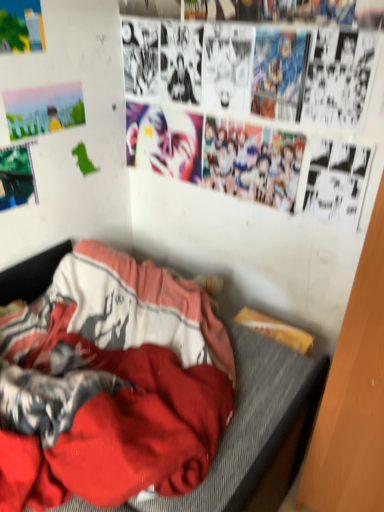
In order to click on watercolor paper poster at upper left, the 2th poster page viewed from the top in this screenshot , I will do click(x=43, y=109).

How much space does watercolor paper poster at upper left, the 2th poster page viewed from the top, occupy horizontally?

watercolor paper poster at upper left, the 2th poster page viewed from the top, is 0.45 inches wide.

Consider the image. How much space does metallic green poster at upper left, the 3th poster page when ordered from top to bottom, occupy horizontally?

metallic green poster at upper left, the 3th poster page when ordered from top to bottom, is 0.39 inches in width.

Locate an element on the screen. The height and width of the screenshot is (512, 384). watercolor paper poster at upper left, which is the second poster page in bottom-to-top order is located at coordinates (43, 109).

Considering their positions, is matte paper poster at upper left, acting as the 1th poster page starting from the top, located in front of or behind red fabric bed at lower left?

matte paper poster at upper left, acting as the 1th poster page starting from the top, is behind red fabric bed at lower left.

Is matte paper poster at upper left, acting as the 1th poster page starting from the top, aimed at red fabric bed at lower left?

No, matte paper poster at upper left, acting as the 1th poster page starting from the top, is not oriented towards red fabric bed at lower left.

From the picture: Considering the relative sizes of matte paper poster at upper left, acting as the 1th poster page starting from the top, and red fabric bed at lower left in the image provided, is matte paper poster at upper left, acting as the 1th poster page starting from the top, wider than red fabric bed at lower left?

No.

Where is `bed on the right side of matte paper poster at upper left, the third poster page ordered from the bottom`? bed on the right side of matte paper poster at upper left, the third poster page ordered from the bottom is located at coordinates (151, 407).

Image resolution: width=384 pixels, height=512 pixels. What are the coordinates of `person above the metallic green poster at upper left, the 3th poster page when ordered from top to bottom (from the image's perspective)` in the screenshot? It's located at (164, 141).

In terms of width, does metallic green poster at upper left, which ranks as the first poster page in bottom-to-top order, look wider or thinner when compared to shiny metallic mask at upper center?

Clearly, metallic green poster at upper left, which ranks as the first poster page in bottom-to-top order, has less width compared to shiny metallic mask at upper center.

How many degrees apart are the facing directions of metallic green poster at upper left, the 3th poster page when ordered from top to bottom, and shiny metallic mask at upper center?

The angular difference between metallic green poster at upper left, the 3th poster page when ordered from top to bottom, and shiny metallic mask at upper center is 89.2 degrees.

Which point is more forward, [22,186] or [161,155]?

The point [22,186] is in front.

Is the depth of shiny metallic mask at upper center less than that of metallic green poster at upper left, which ranks as the first poster page in bottom-to-top order?

No, shiny metallic mask at upper center is further to the viewer.

Between shiny metallic mask at upper center and metallic green poster at upper left, the 3th poster page when ordered from top to bottom, which one has larger width?

Wider between the two is shiny metallic mask at upper center.

From a real-world perspective, which is physically above, shiny metallic mask at upper center or metallic green poster at upper left, the 3th poster page when ordered from top to bottom?

shiny metallic mask at upper center is physically above.

Could you tell me if shiny metallic mask at upper center is facing metallic green poster at upper left, the 3th poster page when ordered from top to bottom?

Yes, shiny metallic mask at upper center faces towards metallic green poster at upper left, the 3th poster page when ordered from top to bottom.

Is watercolor paper poster at upper left, which is the second poster page in bottom-to-top order, in contact with matte paper poster at upper left, acting as the 1th poster page starting from the top?

No, watercolor paper poster at upper left, which is the second poster page in bottom-to-top order, is not beside matte paper poster at upper left, acting as the 1th poster page starting from the top.

Can you confirm if watercolor paper poster at upper left, the 2th poster page viewed from the top, is taller than matte paper poster at upper left, the third poster page ordered from the bottom?

Incorrect, the height of watercolor paper poster at upper left, the 2th poster page viewed from the top, is not larger of that of matte paper poster at upper left, the third poster page ordered from the bottom.

From a real-world perspective, which object stands above the other?

matte paper poster at upper left, acting as the 1th poster page starting from the top, from a real-world perspective.

Which of these two, watercolor paper poster at upper left, which is the second poster page in bottom-to-top order, or shiny metallic mask at upper center, stands taller?

shiny metallic mask at upper center is taller.

From the image's perspective, which one is positioned higher, watercolor paper poster at upper left, which is the second poster page in bottom-to-top order, or shiny metallic mask at upper center?

From the image's view, watercolor paper poster at upper left, which is the second poster page in bottom-to-top order, is above.

Is watercolor paper poster at upper left, the 2th poster page viewed from the top, facing towards shiny metallic mask at upper center?

No, watercolor paper poster at upper left, the 2th poster page viewed from the top, is not facing towards shiny metallic mask at upper center.

Is watercolor paper poster at upper left, which is the second poster page in bottom-to-top order, surrounding shiny metallic mask at upper center?

No, shiny metallic mask at upper center is not inside watercolor paper poster at upper left, which is the second poster page in bottom-to-top order.

From a real-world perspective, is metallic green poster at upper left, the 3th poster page when ordered from top to bottom, located beneath matte paper poster at upper left, the third poster page ordered from the bottom?

Yes, from a real-world perspective, metallic green poster at upper left, the 3th poster page when ordered from top to bottom, is under matte paper poster at upper left, the third poster page ordered from the bottom.

Considering their positions, is metallic green poster at upper left, the 3th poster page when ordered from top to bottom, located in front of or behind matte paper poster at upper left, acting as the 1th poster page starting from the top?

In the image, metallic green poster at upper left, the 3th poster page when ordered from top to bottom, appears behind matte paper poster at upper left, acting as the 1th poster page starting from the top.

Which object is thinner, metallic green poster at upper left, which ranks as the first poster page in bottom-to-top order, or matte paper poster at upper left, the third poster page ordered from the bottom?

metallic green poster at upper left, which ranks as the first poster page in bottom-to-top order.

Who is bigger, metallic green poster at upper left, which ranks as the first poster page in bottom-to-top order, or matte paper poster at upper left, acting as the 1th poster page starting from the top?

metallic green poster at upper left, which ranks as the first poster page in bottom-to-top order.

Considering the relative positions of shiny metallic mask at upper center and matte paper poster at upper left, the third poster page ordered from the bottom, in the image provided, is shiny metallic mask at upper center to the left of matte paper poster at upper left, the third poster page ordered from the bottom, from the viewer's perspective?

No.

Which object is closer to the camera taking this photo, shiny metallic mask at upper center or matte paper poster at upper left, acting as the 1th poster page starting from the top?

matte paper poster at upper left, acting as the 1th poster page starting from the top, is closer to the camera.

Can you tell me how much shiny metallic mask at upper center and matte paper poster at upper left, acting as the 1th poster page starting from the top, differ in facing direction?

89.9 degrees.

Can you confirm if shiny metallic mask at upper center is wider than matte paper poster at upper left, the third poster page ordered from the bottom?

Indeed, shiny metallic mask at upper center has a greater width compared to matte paper poster at upper left, the third poster page ordered from the bottom.

Image resolution: width=384 pixels, height=512 pixels. I want to click on the 2nd poster page to the left of the red fabric bed at lower left, starting your count from the anchor, so click(x=21, y=26).

Identify the location of person that is above the metallic green poster at upper left, the 3th poster page when ordered from top to bottom (from the image's perspective). (164, 141).

When comparing their distances from red fabric bed at lower left, does watercolor paper poster at upper left, the 2th poster page viewed from the top, or matte paper poster at upper left, acting as the 1th poster page starting from the top, seem further?

Based on the image, matte paper poster at upper left, acting as the 1th poster page starting from the top, appears to be further to red fabric bed at lower left.

When comparing their distances from matte paper poster at upper left, acting as the 1th poster page starting from the top, does shiny metallic mask at upper center or metallic green poster at upper left, the 3th poster page when ordered from top to bottom, seem further?

shiny metallic mask at upper center lies further to matte paper poster at upper left, acting as the 1th poster page starting from the top, than the other object.

Estimate the real-world distances between objects in this image. Which object is closer to matte paper poster at upper left, the third poster page ordered from the bottom, red fabric bed at lower left or shiny metallic mask at upper center?

The object closer to matte paper poster at upper left, the third poster page ordered from the bottom, is shiny metallic mask at upper center.

When comparing their distances from shiny metallic mask at upper center, does matte paper poster at upper left, acting as the 1th poster page starting from the top, or red fabric bed at lower left seem closer?

The object closer to shiny metallic mask at upper center is matte paper poster at upper left, acting as the 1th poster page starting from the top.

Based on their spatial positions, is metallic green poster at upper left, the 3th poster page when ordered from top to bottom, or matte paper poster at upper left, the third poster page ordered from the bottom, closer to shiny metallic mask at upper center?

Based on the image, metallic green poster at upper left, the 3th poster page when ordered from top to bottom, appears to be nearer to shiny metallic mask at upper center.

Considering their positions, is shiny metallic mask at upper center positioned further to matte paper poster at upper left, the third poster page ordered from the bottom, than red fabric bed at lower left?

red fabric bed at lower left lies further to matte paper poster at upper left, the third poster page ordered from the bottom, than the other object.

When comparing their distances from watercolor paper poster at upper left, the 2th poster page viewed from the top, does metallic green poster at upper left, the 3th poster page when ordered from top to bottom, or shiny metallic mask at upper center seem closer?

Among the two, metallic green poster at upper left, the 3th poster page when ordered from top to bottom, is located nearer to watercolor paper poster at upper left, the 2th poster page viewed from the top.

Estimate the real-world distances between objects in this image. Which object is closer to metallic green poster at upper left, the 3th poster page when ordered from top to bottom, matte paper poster at upper left, the third poster page ordered from the bottom, or watercolor paper poster at upper left, which is the second poster page in bottom-to-top order?

The object closer to metallic green poster at upper left, the 3th poster page when ordered from top to bottom, is watercolor paper poster at upper left, which is the second poster page in bottom-to-top order.

Where is `poster page between matte paper poster at upper left, acting as the 1th poster page starting from the top, and metallic green poster at upper left, which ranks as the first poster page in bottom-to-top order, from top to bottom`? poster page between matte paper poster at upper left, acting as the 1th poster page starting from the top, and metallic green poster at upper left, which ranks as the first poster page in bottom-to-top order, from top to bottom is located at coordinates (43, 109).

Where is `poster page between watercolor paper poster at upper left, which is the second poster page in bottom-to-top order, and red fabric bed at lower left from top to bottom`? This screenshot has width=384, height=512. poster page between watercolor paper poster at upper left, which is the second poster page in bottom-to-top order, and red fabric bed at lower left from top to bottom is located at coordinates (16, 177).

Where is `person between matte paper poster at upper left, the third poster page ordered from the bottom, and red fabric bed at lower left in the up-down direction`? This screenshot has width=384, height=512. person between matte paper poster at upper left, the third poster page ordered from the bottom, and red fabric bed at lower left in the up-down direction is located at coordinates (164, 141).